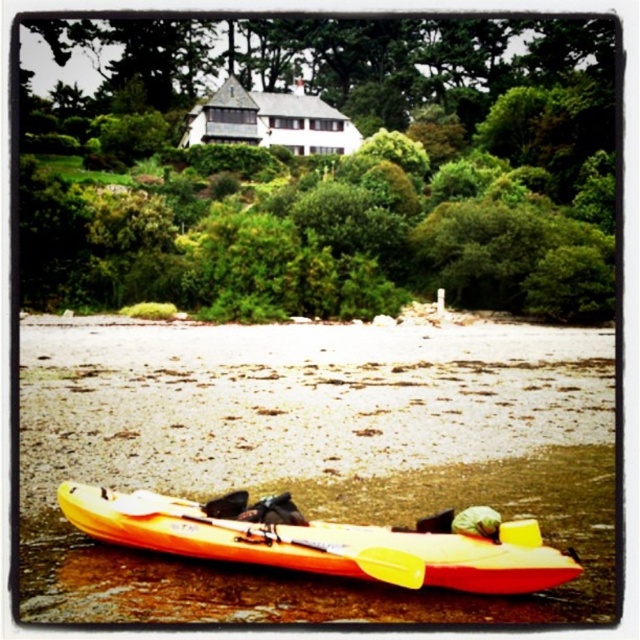
What do you see at coordinates (342, 161) in the screenshot? I see `green leafy tree at upper center` at bounding box center [342, 161].

Is green leafy tree at upper center smaller than yellow matte canoe at lower center?

No.

Is point (336, 77) positioned behind point (468, 548)?

Yes, point (336, 77) is farther from viewer.

You are a GUI agent. You are given a task and a screenshot of the screen. Output one action in this format:
    pyautogui.click(x=<x>, y=<y>)
    Task: Click on the green leafy tree at upper center
    This screenshot has height=640, width=640.
    Given the screenshot: What is the action you would take?
    pyautogui.click(x=342, y=161)

Does yellow matte canoe at lower center have a greater width compared to yellow plastic paddle at lower center?

Yes.

From the picture: Is yellow matte canoe at lower center in front of yellow plastic paddle at lower center?

Yes, it is.

Locate an element on the screen. This screenshot has height=640, width=640. yellow matte canoe at lower center is located at coordinates pos(326,540).

Does point (465, 52) lie behind point (140, 490)?

Yes, it is.

Between green leafy tree at upper center and yellow plastic paddle at lower center, which one appears on the left side from the viewer's perspective?

green leafy tree at upper center is more to the left.

Between point (340, 272) and point (419, 568), which one is positioned in front?

Positioned in front is point (419, 568).

Where is `green leafy tree at upper center`? This screenshot has height=640, width=640. green leafy tree at upper center is located at coordinates (342, 161).